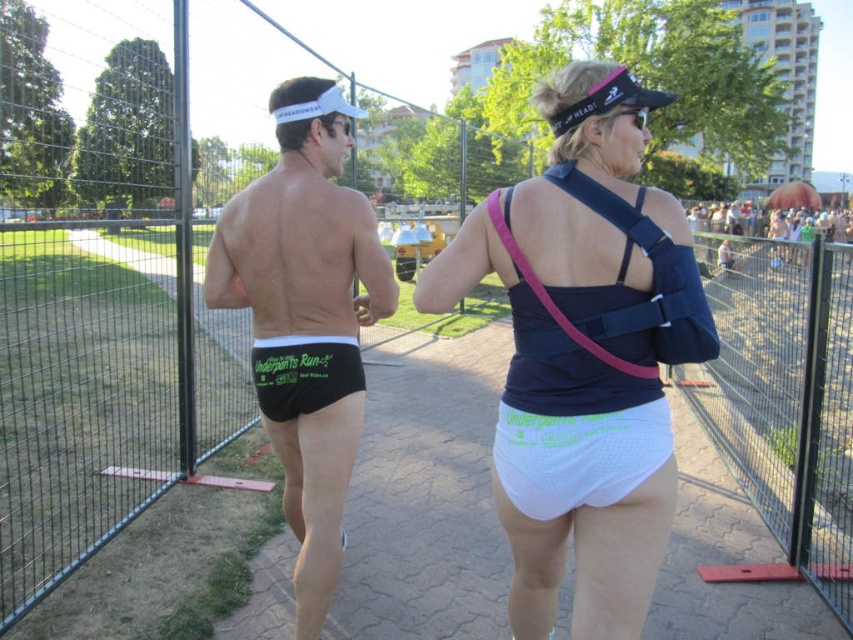
Is metal fence at right behind white mesh underwear at lower center?

Yes, metal fence at right is behind white mesh underwear at lower center.

Image resolution: width=853 pixels, height=640 pixels. In order to click on metal fence at right in this screenshot , I will do `click(782, 400)`.

Between metal fence at center and white mesh underwear at center, which one is positioned lower?

Positioned lower is white mesh underwear at center.

Which is behind, point (125, 44) or point (706, 275)?

Positioned behind is point (125, 44).

Where is `metal fence at center`? Image resolution: width=853 pixels, height=640 pixels. metal fence at center is located at coordinates (103, 300).

You are a GUI agent. You are given a task and a screenshot of the screen. Output one action in this format:
    pyautogui.click(x=<x>, y=<y>)
    Task: Click on the metal fence at center
    The height and width of the screenshot is (640, 853).
    Given the screenshot: What is the action you would take?
    pyautogui.click(x=103, y=300)

Which is more to the right, metal fence at center or black mesh shorts at center?

From the viewer's perspective, black mesh shorts at center appears more on the right side.

Image resolution: width=853 pixels, height=640 pixels. I want to click on metal fence at center, so click(103, 300).